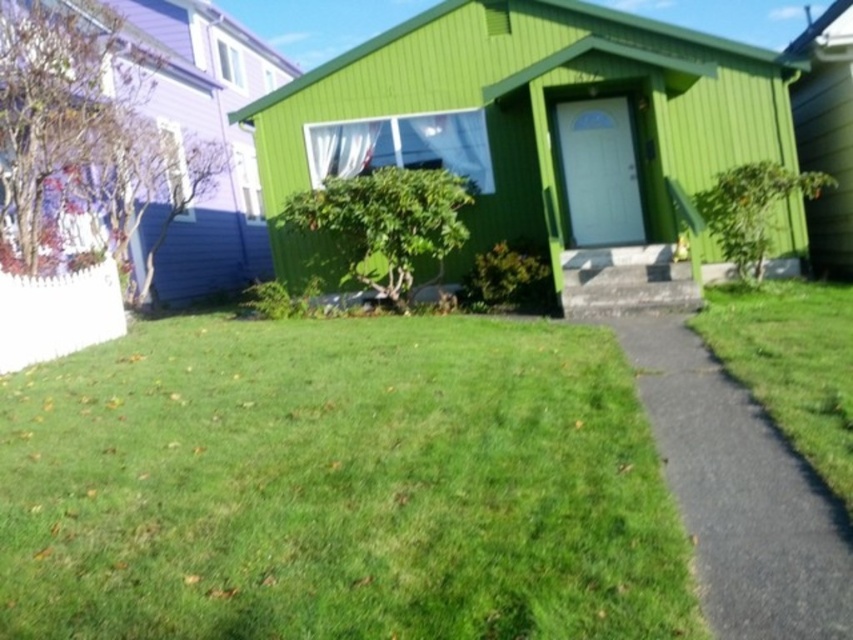
Can you confirm if black asphalt driveway at lower right is bigger than green grass at lower right?

No.

Identify the location of black asphalt driveway at lower right. (740, 492).

At what (x,y) coordinates should I click in order to perform the action: click on black asphalt driveway at lower right. Please return your answer as a coordinate pair (x, y). Image resolution: width=853 pixels, height=640 pixels. Looking at the image, I should click on (740, 492).

Can you confirm if green grass at center is positioned below green grass at lower right?

Correct, green grass at center is located below green grass at lower right.

Measure the distance between green grass at center and camera.

The distance of green grass at center from camera is 4.04 feet.

The height and width of the screenshot is (640, 853). What are the coordinates of `green grass at center` in the screenshot? It's located at (337, 484).

Is green grass at center thinner than black asphalt driveway at lower right?

Incorrect, green grass at center's width is not less than black asphalt driveway at lower right's.

Is green grass at center to the left of black asphalt driveway at lower right from the viewer's perspective?

Correct, you'll find green grass at center to the left of black asphalt driveway at lower right.

What do you see at coordinates (337, 484) in the screenshot? Image resolution: width=853 pixels, height=640 pixels. I see `green grass at center` at bounding box center [337, 484].

Locate an element on the screen. The height and width of the screenshot is (640, 853). green grass at center is located at coordinates (337, 484).